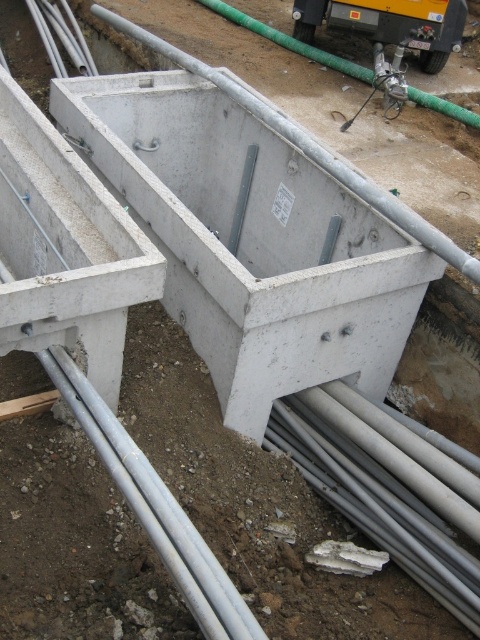
You are a construction worker who needs to place a new pipe that is 0.5 meters tall. You see the silver metallic pipes at lower center and the concrete at center. Which object can the new pipe be placed on top of without exceeding its height?

The silver metallic pipes at lower center has a lesser height compared to concrete at center, so the new pipe can be placed on top of the concrete at center since it is taller and can support the height of the new pipe.

You are an inspector checking the construction site. You need to determine if the concrete at center is higher than the matte green hose at upper right. Based on the scene, can you confirm this?

The concrete at center has a greater height compared to the matte green hose at upper right, so yes, the concrete at center is higher than the matte green hose at upper right.

You are a construction worker standing at the edge of the trench. You need to place a new pipe at the same location as the silver metallic pipes at lower center. What are the coordinates where you should place the new pipe?

You should place the new pipe at coordinates point (x=155, y=508) where the silver metallic pipes at lower center are located.